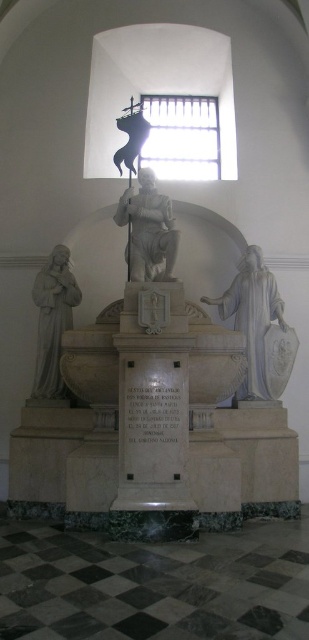
Can you confirm if white marble monument at center is thinner than matte white statue at upper center?

No.

Is white marble monument at center above matte white statue at upper center?

Actually, white marble monument at center is below matte white statue at upper center.

Between point (93, 369) and point (118, 163), which one is positioned behind?

Positioned behind is point (118, 163).

This screenshot has height=640, width=309. Identify the location of white marble monument at center. (123, 413).

Between white marble monument at center and white marble statue at left, which one is positioned higher?

white marble statue at left is above.

Can you confirm if white marble monument at center is shorter than white marble statue at left?

No.

Is point (295, 492) positioned after point (51, 269)?

No.

Identify the location of white marble monument at center. (123, 413).

Is point (66, 250) in front of point (125, 120)?

Yes, point (66, 250) is in front of point (125, 120).

You are a GUI agent. You are given a task and a screenshot of the screen. Output one action in this format:
    pyautogui.click(x=<x>, y=<y>)
    Task: Click on the white marble statue at left
    Image resolution: width=309 pixels, height=640 pixels.
    Given the screenshot: What is the action you would take?
    pyautogui.click(x=53, y=320)

Does point (54, 280) lie behind point (143, 128)?

No, it is in front of (143, 128).

Image resolution: width=309 pixels, height=640 pixels. I want to click on white marble statue at left, so click(x=53, y=320).